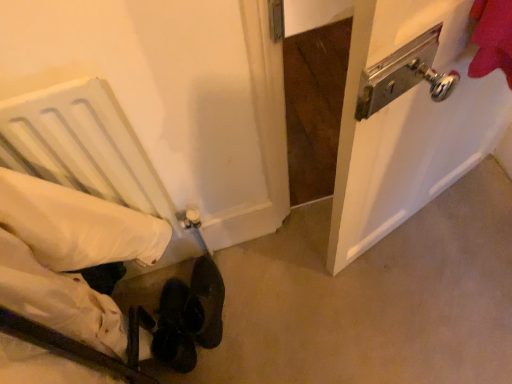
Question: Considering the relative positions of white fabric bed at lower left and leather at lower center in the image provided, is white fabric bed at lower left behind leather at lower center?

Choices:
 (A) no
 (B) yes

Answer: (A)

Question: Is the depth of white fabric bed at lower left less than that of leather at lower center?

Choices:
 (A) no
 (B) yes

Answer: (B)

Question: Considering the relative sizes of white fabric bed at lower left and leather at lower center in the image provided, is white fabric bed at lower left taller than leather at lower center?

Choices:
 (A) no
 (B) yes

Answer: (B)

Question: Are white fabric bed at lower left and leather at lower center located far from each other?

Choices:
 (A) yes
 (B) no

Answer: (B)

Question: Can you confirm if white fabric bed at lower left is shorter than leather at lower center?

Choices:
 (A) no
 (B) yes

Answer: (A)

Question: Is white fabric bed at lower left taller or shorter than leather at lower center?

Choices:
 (A) short
 (B) tall

Answer: (B)

Question: From the image's perspective, relative to leather at lower center, is white fabric bed at lower left above or below?

Choices:
 (A) below
 (B) above

Answer: (B)

Question: Is white fabric bed at lower left inside the boundaries of leather at lower center, or outside?

Choices:
 (A) outside
 (B) inside

Answer: (A)

Question: In terms of width, does white fabric bed at lower left look wider or thinner when compared to leather at lower center?

Choices:
 (A) wide
 (B) thin

Answer: (B)

Question: Looking at their shapes, would you say leather at lower center is wider or thinner than white fabric bed at lower left?

Choices:
 (A) wide
 (B) thin

Answer: (A)

Question: From the image's perspective, is leather at lower center above or below white fabric bed at lower left?

Choices:
 (A) above
 (B) below

Answer: (B)

Question: Is leather at lower center inside or outside of white fabric bed at lower left?

Choices:
 (A) outside
 (B) inside

Answer: (A)

Question: Considering the positions of leather at lower center and white fabric bed at lower left in the image, is leather at lower center taller or shorter than white fabric bed at lower left?

Choices:
 (A) short
 (B) tall

Answer: (A)

Question: In terms of width, does white fabric bed at lower left look wider or thinner when compared to metallic silver door handle at upper right?

Choices:
 (A) thin
 (B) wide

Answer: (A)

Question: From their relative heights in the image, would you say white fabric bed at lower left is taller or shorter than metallic silver door handle at upper right?

Choices:
 (A) short
 (B) tall

Answer: (B)